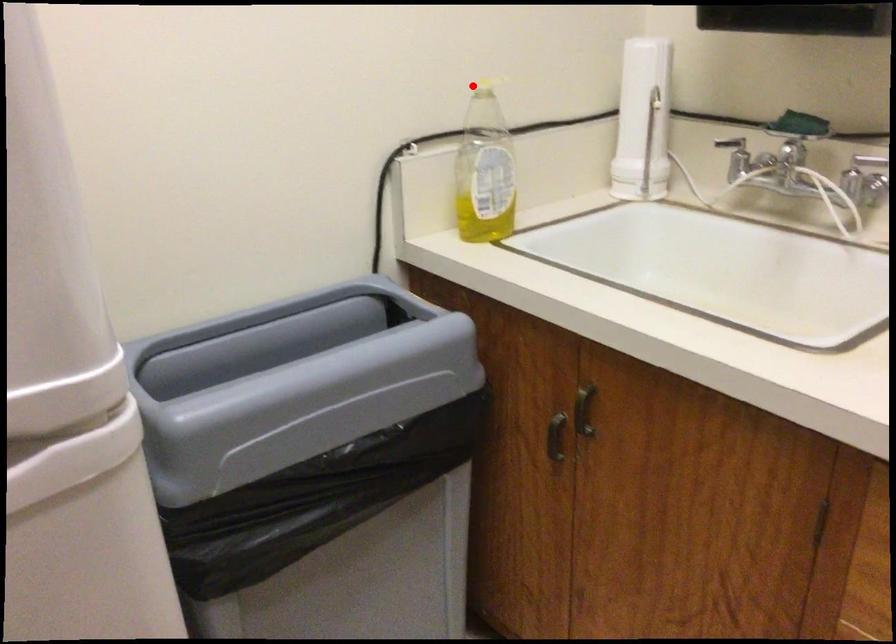
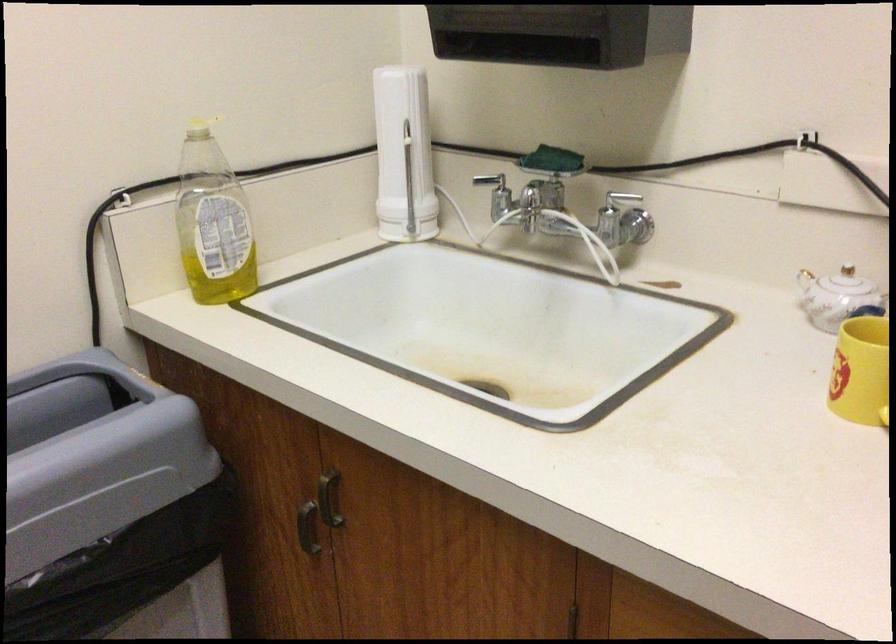
Question: I am providing you with two images of the same scene from different viewpoints. Image1 has a red point marked. In image2, the corresponding 3D location appears at what relative position? Reply with the corresponding letter.

Choices:
 (A) Closer
 (B) Farther

Answer: (A)